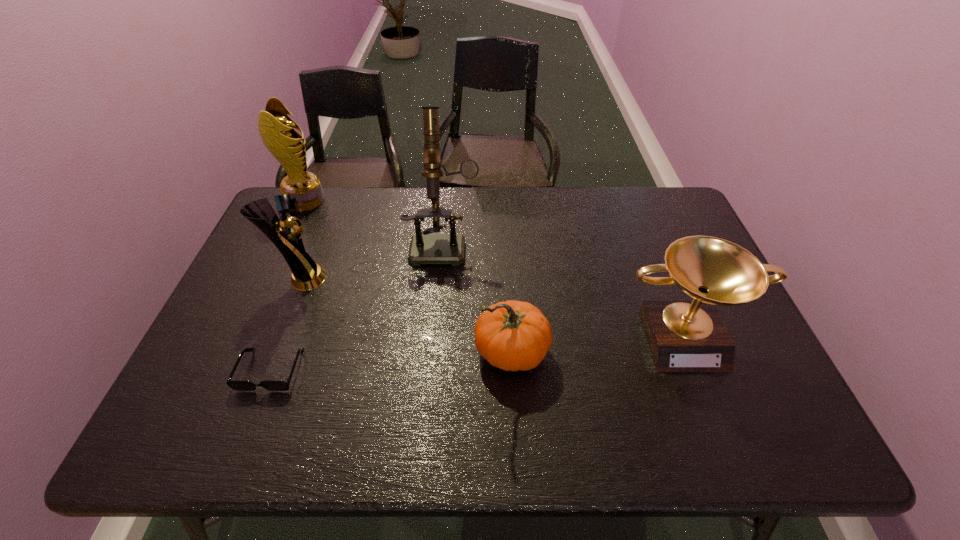
Locate an element on the screen. This screenshot has height=540, width=960. blank space at the near edge of the desktop is located at coordinates (655, 417).

In the image, there is a desktop. In order to click on blank space at the left edge in this screenshot , I will do (235, 407).

You are a GUI agent. You are given a task and a screenshot of the screen. Output one action in this format:
    pyautogui.click(x=<x>, y=<y>)
    Task: Click on the free space at the right edge of the desktop
    The width and height of the screenshot is (960, 540).
    Given the screenshot: What is the action you would take?
    tap(670, 238)

Locate an element on the screen. free space at the near left corner is located at coordinates 218,445.

You are a GUI agent. You are given a task and a screenshot of the screen. Output one action in this format:
    pyautogui.click(x=<x>, y=<y>)
    Task: Click on the vacant space at the far right corner of the desktop
    The width and height of the screenshot is (960, 540).
    Given the screenshot: What is the action you would take?
    pyautogui.click(x=668, y=201)

Find the location of a particular element. free space between the tallest award and the sunglasses is located at coordinates (288, 285).

At what (x,y) coordinates should I click in order to perform the action: click on empty space that is in between the pumpkin and the fifth shortest object. Please return your answer as a coordinate pair (x, y). The image size is (960, 540). Looking at the image, I should click on (409, 276).

The height and width of the screenshot is (540, 960). I want to click on unoccupied area between the farthest award and the pumpkin, so click(x=409, y=276).

Where is `empty location between the pumpkin and the sunglasses`? This screenshot has height=540, width=960. empty location between the pumpkin and the sunglasses is located at coordinates (392, 361).

Where is `free spot between the second farthest award and the microscope`? free spot between the second farthest award and the microscope is located at coordinates (372, 260).